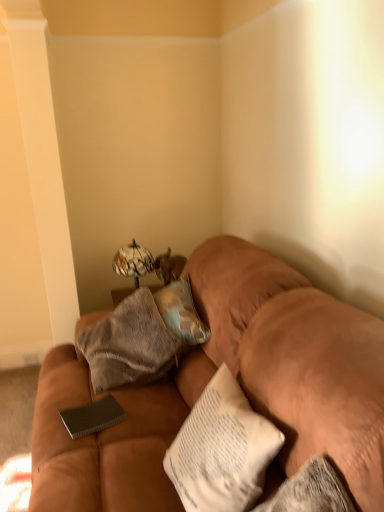
Question: Is suede brown couch at center surrounded by black textured notebook at center?

Choices:
 (A) yes
 (B) no

Answer: (B)

Question: From a real-world perspective, is black textured notebook at center positioned under suede brown couch at center based on gravity?

Choices:
 (A) yes
 (B) no

Answer: (A)

Question: Considering the relative sizes of black textured notebook at center and suede brown couch at center in the image provided, is black textured notebook at center thinner than suede brown couch at center?

Choices:
 (A) yes
 (B) no

Answer: (A)

Question: Can you confirm if black textured notebook at center is shorter than suede brown couch at center?

Choices:
 (A) yes
 (B) no

Answer: (A)

Question: Is black textured notebook at center closer to the viewer compared to suede brown couch at center?

Choices:
 (A) yes
 (B) no

Answer: (B)

Question: Can you confirm if black textured notebook at center is smaller than suede brown couch at center?

Choices:
 (A) yes
 (B) no

Answer: (A)

Question: From a real-world perspective, is textured beige pillow at center physically above marble-patterned glass table lamp at upper center?

Choices:
 (A) yes
 (B) no

Answer: (A)

Question: Is textured beige pillow at center far from marble-patterned glass table lamp at upper center?

Choices:
 (A) no
 (B) yes

Answer: (A)

Question: From the image's perspective, is textured beige pillow at center located beneath marble-patterned glass table lamp at upper center?

Choices:
 (A) yes
 (B) no

Answer: (A)

Question: Is textured beige pillow at center wider than marble-patterned glass table lamp at upper center?

Choices:
 (A) no
 (B) yes

Answer: (A)

Question: Considering the relative sizes of textured beige pillow at center and marble-patterned glass table lamp at upper center in the image provided, is textured beige pillow at center bigger than marble-patterned glass table lamp at upper center?

Choices:
 (A) yes
 (B) no

Answer: (B)

Question: Is textured beige pillow at center looking in the opposite direction of marble-patterned glass table lamp at upper center?

Choices:
 (A) no
 (B) yes

Answer: (A)

Question: Are suede brown couch at center and black textured notebook at center located far from each other?

Choices:
 (A) no
 (B) yes

Answer: (A)